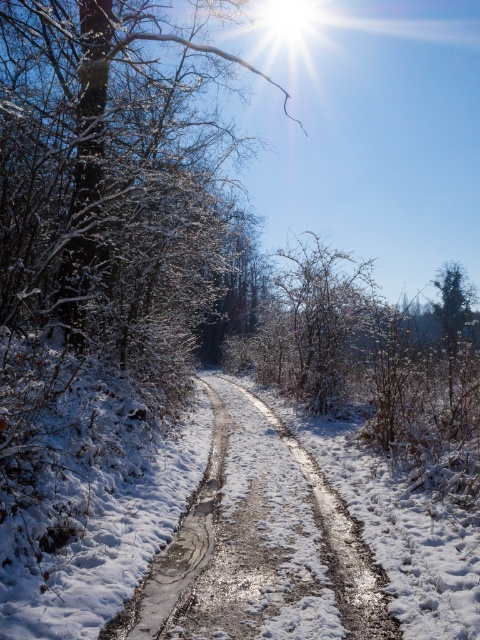
Question: Can you confirm if white frosty tree at upper center is thinner than slick mud track at center?

Choices:
 (A) no
 (B) yes

Answer: (A)

Question: Can you confirm if white frosty tree at upper center is wider than slick mud track at center?

Choices:
 (A) no
 (B) yes

Answer: (B)

Question: Observing the image, what is the correct spatial positioning of white frosty tree at upper center in reference to slick mud track at center?

Choices:
 (A) right
 (B) left

Answer: (B)

Question: Which object appears closest to the camera in this image?

Choices:
 (A) slick mud track at center
 (B) white frosty tree at upper center

Answer: (A)

Question: Which object is closer to the camera taking this photo?

Choices:
 (A) slick mud track at center
 (B) white frosty tree at upper center

Answer: (A)